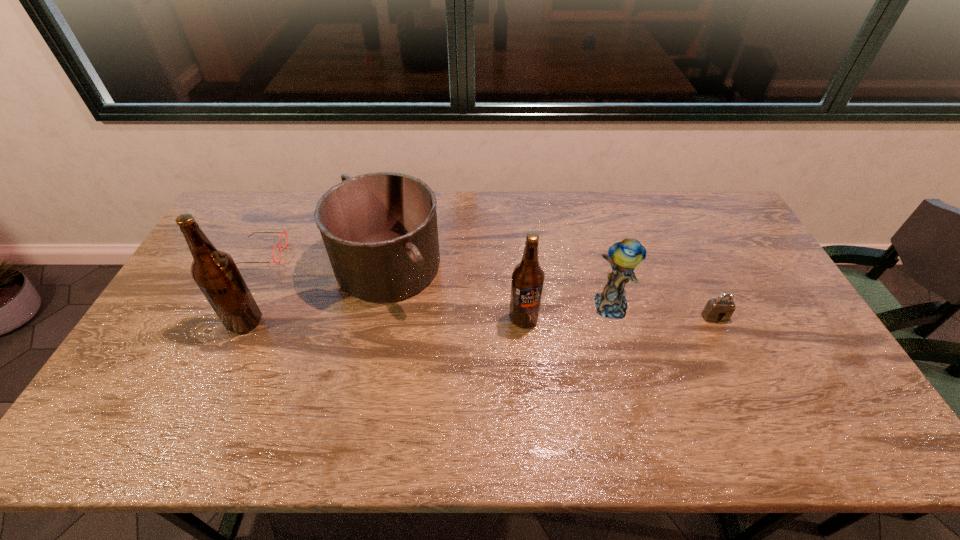
Identify the location of vacant space situated 0.090m on the label of the taller beer bottle. (197, 322).

Where is `free region located on the label of the taller beer bottle`? free region located on the label of the taller beer bottle is located at coordinates (200, 322).

This screenshot has width=960, height=540. In order to click on vacant space located on the label of the taller beer bottle in this screenshot , I will do `click(193, 322)`.

Locate an element on the screen. free space located on the label of the third object from right to left is located at coordinates (527, 357).

This screenshot has width=960, height=540. In order to click on free space located on the front of the pan in this screenshot , I will do `click(375, 328)`.

Find the location of a particular element. The width and height of the screenshot is (960, 540). free space located on the front-facing side of the shortest object is located at coordinates pyautogui.click(x=402, y=254).

Where is `vacant point located 0.230m on the face of the fifth object from left to right`? Image resolution: width=960 pixels, height=540 pixels. vacant point located 0.230m on the face of the fifth object from left to right is located at coordinates (636, 399).

Image resolution: width=960 pixels, height=540 pixels. In order to click on vacant space located at the front of the padlock near the keyhole in this screenshot , I will do `click(729, 346)`.

This screenshot has width=960, height=540. I want to click on object present at the far edge, so click(x=380, y=231).

Identify the location of object present at the left edge. Image resolution: width=960 pixels, height=540 pixels. (282, 231).